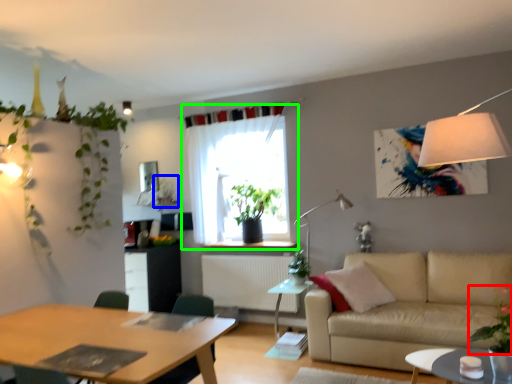
Question: Based on their relative distances, which object is farther from plant (highlighted by a red box)? Choose from plant (highlighted by a blue box) and curtain (highlighted by a green box).

Choices:
 (A) plant
 (B) curtain

Answer: (A)